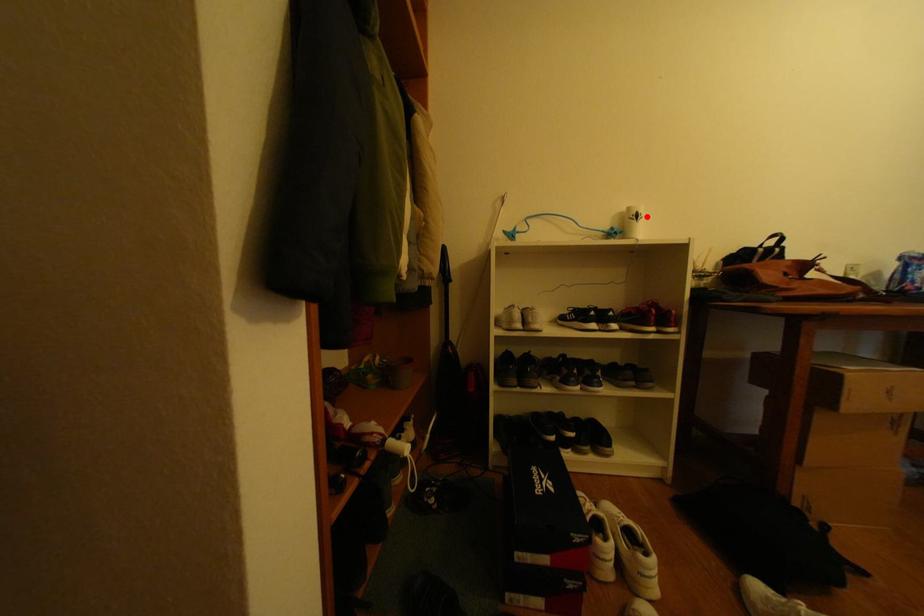
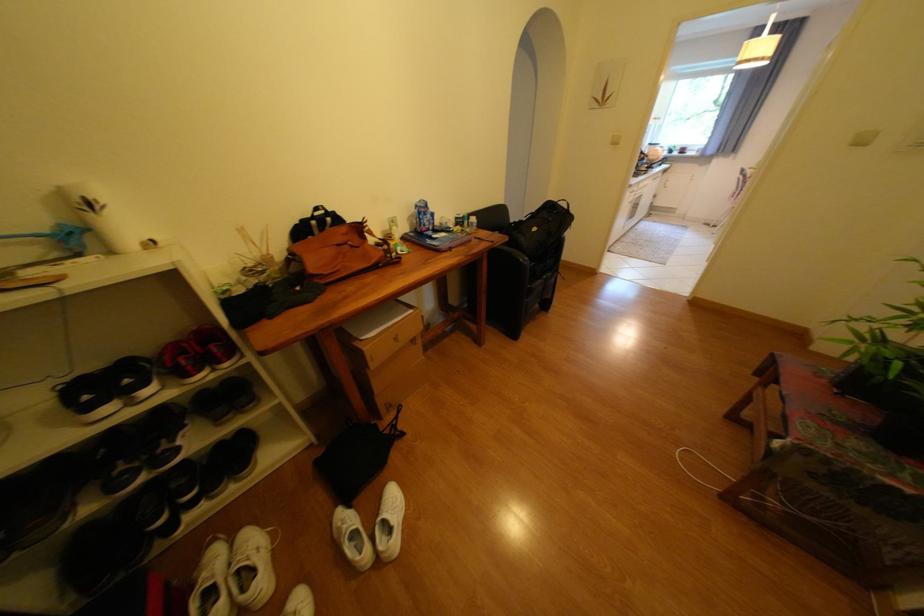
Locate, in the second image, the point that corresponds to the highlighted location in the first image.

(100, 205)